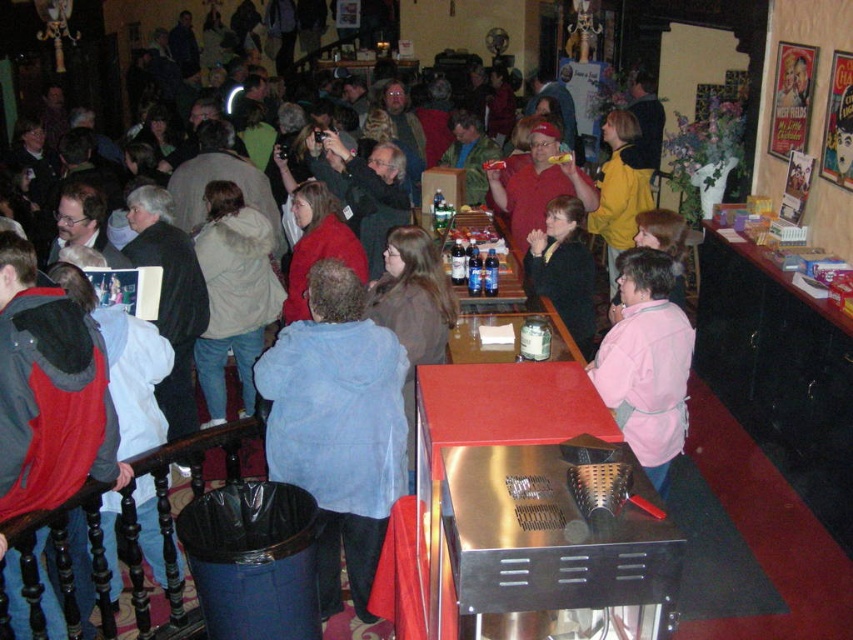
Is blue fleece jacket at center above pink fleece jacket at center?

No.

Find the location of a particular element. blue fleece jacket at center is located at coordinates (338, 426).

The width and height of the screenshot is (853, 640). In order to click on blue fleece jacket at center in this screenshot , I will do `click(338, 426)`.

Which is behind, point (103, 378) or point (587, 369)?

The point (587, 369) is more distant.

Does red jacket at left have a greater height compared to pink fleece jacket at center?

No.

The width and height of the screenshot is (853, 640). In order to click on red jacket at left in this screenshot , I will do `click(49, 392)`.

Which is behind, point (42, 609) or point (579, 321)?

The point (579, 321) is more distant.

Can you confirm if red jacket at left is positioned to the left of black matte jacket at center?

Correct, you'll find red jacket at left to the left of black matte jacket at center.

Is point (9, 480) closer to camera compared to point (534, 268)?

Yes, it is.

What are the coordinates of `red jacket at left` in the screenshot? It's located at (49, 392).